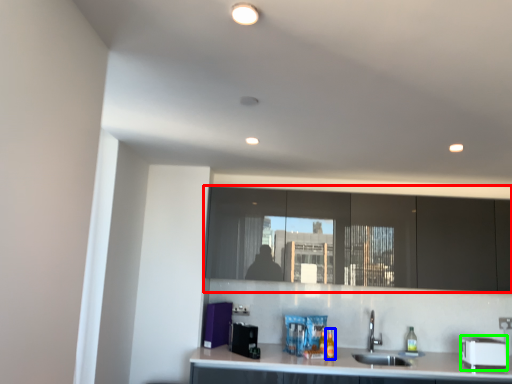
Question: Based on their relative distances, which object is nearer to cabinetry (highlighted by a red box)? Choose from bottle (highlighted by a blue box) and appliance (highlighted by a green box).

Choices:
 (A) bottle
 (B) appliance

Answer: (B)